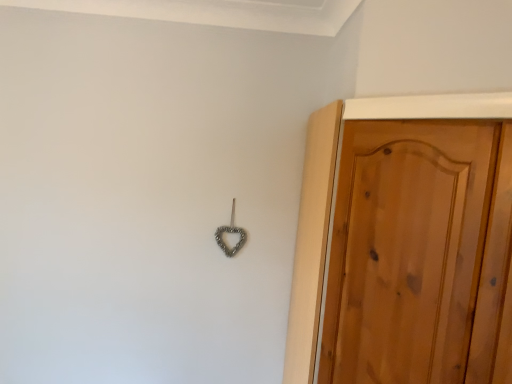
The width and height of the screenshot is (512, 384). What are the coordinates of `metallic heart-shaped hook at center` in the screenshot? It's located at (231, 233).

Describe the element at coordinates (231, 233) in the screenshot. I see `metallic heart-shaped hook at center` at that location.

The width and height of the screenshot is (512, 384). In order to click on wooden door at right in this screenshot , I will do `click(407, 250)`.

What do you see at coordinates (407, 250) in the screenshot?
I see `wooden door at right` at bounding box center [407, 250].

You are a GUI agent. You are given a task and a screenshot of the screen. Output one action in this format:
    pyautogui.click(x=<x>, y=<y>)
    Task: Click on the metallic heart-shaped hook at center
    The width and height of the screenshot is (512, 384).
    Given the screenshot: What is the action you would take?
    pyautogui.click(x=231, y=233)

Which is more to the left, wooden door at right or metallic heart-shaped hook at center?

Positioned to the left is metallic heart-shaped hook at center.

Considering the relative positions of wooden door at right and metallic heart-shaped hook at center in the image provided, is wooden door at right in front of metallic heart-shaped hook at center?

Yes, wooden door at right is in front of metallic heart-shaped hook at center.

Is point (455, 216) closer to camera compared to point (228, 248)?

Yes, point (455, 216) is closer to viewer.

From the image's perspective, does wooden door at right appear lower than metallic heart-shaped hook at center?

Yes, from the image's perspective, wooden door at right is beneath metallic heart-shaped hook at center.

From a real-world perspective, between wooden door at right and metallic heart-shaped hook at center, who is vertically lower?

wooden door at right is physically lower.

Can you confirm if wooden door at right is wider than metallic heart-shaped hook at center?

Indeed, wooden door at right has a greater width compared to metallic heart-shaped hook at center.

Considering the relative sizes of wooden door at right and metallic heart-shaped hook at center in the image provided, is wooden door at right shorter than metallic heart-shaped hook at center?

No, wooden door at right is not shorter than metallic heart-shaped hook at center.

Does wooden door at right have a smaller size compared to metallic heart-shaped hook at center?

Actually, wooden door at right might be larger than metallic heart-shaped hook at center.

Would you say wooden door at right contains metallic heart-shaped hook at center?

That's incorrect, metallic heart-shaped hook at center is not inside wooden door at right.

Does wooden door at right touch metallic heart-shaped hook at center?

No, wooden door at right is not touching metallic heart-shaped hook at center.

Is wooden door at right looking in the opposite direction of metallic heart-shaped hook at center?

No, wooden door at right's orientation is not away from metallic heart-shaped hook at center.

How distant is wooden door at right from metallic heart-shaped hook at center?

wooden door at right and metallic heart-shaped hook at center are 32.67 inches apart.

Locate an element on the screen. The width and height of the screenshot is (512, 384). door below the metallic heart-shaped hook at center (from the image's perspective) is located at coordinates (407, 250).

Which is more to the left, metallic heart-shaped hook at center or wooden door at right?

Positioned to the left is metallic heart-shaped hook at center.

Is the position of metallic heart-shaped hook at center less distant than that of wooden door at right?

That is False.

Looking at this image, which is nearer, (232, 208) or (332, 254)?

The point (332, 254) is closer to the camera.

From the image's perspective, is metallic heart-shaped hook at center below wooden door at right?

No, from the image's perspective, metallic heart-shaped hook at center is not below wooden door at right.

From a real-world perspective, is metallic heart-shaped hook at center on wooden door at right?

Indeed, from a real-world perspective, metallic heart-shaped hook at center stands above wooden door at right.

Does metallic heart-shaped hook at center have a greater width compared to wooden door at right?

In fact, metallic heart-shaped hook at center might be narrower than wooden door at right.

Can you confirm if metallic heart-shaped hook at center is shorter than wooden door at right?

Indeed, metallic heart-shaped hook at center has a lesser height compared to wooden door at right.

Who is smaller, metallic heart-shaped hook at center or wooden door at right?

metallic heart-shaped hook at center.

Would you say metallic heart-shaped hook at center is inside or outside wooden door at right?

metallic heart-shaped hook at center lies outside wooden door at right.

Is metallic heart-shaped hook at center far from wooden door at right?

That's not correct — metallic heart-shaped hook at center is a little close to wooden door at right.

Could you tell me if metallic heart-shaped hook at center is turned towards wooden door at right?

No, metallic heart-shaped hook at center is not turned towards wooden door at right.

How many degrees apart are the facing directions of metallic heart-shaped hook at center and wooden door at right?

They differ by 49 degrees in their facing directions.

You are a GUI agent. You are given a task and a screenshot of the screen. Output one action in this format:
    pyautogui.click(x=<x>, y=<y>)
    Task: Click on the door in front of the metallic heart-shaped hook at center
    This screenshot has height=384, width=512.
    Given the screenshot: What is the action you would take?
    pyautogui.click(x=407, y=250)

Locate an element on the screen. Image resolution: width=512 pixels, height=384 pixels. door below the metallic heart-shaped hook at center (from the image's perspective) is located at coordinates (407, 250).

The width and height of the screenshot is (512, 384). Identify the location of door below the metallic heart-shaped hook at center (from a real-world perspective). (407, 250).